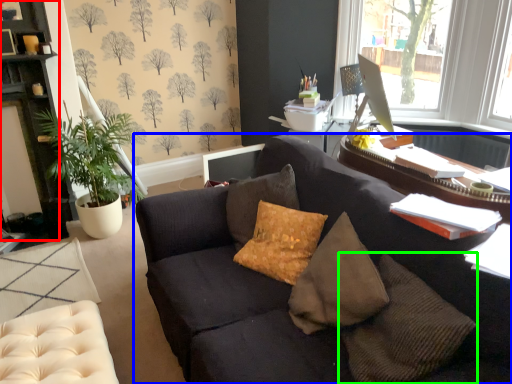
Question: Which is nearer to the cabinetry (highlighted by a red box)? studio couch (highlighted by a blue box) or pillow (highlighted by a green box).

Choices:
 (A) studio couch
 (B) pillow

Answer: (A)